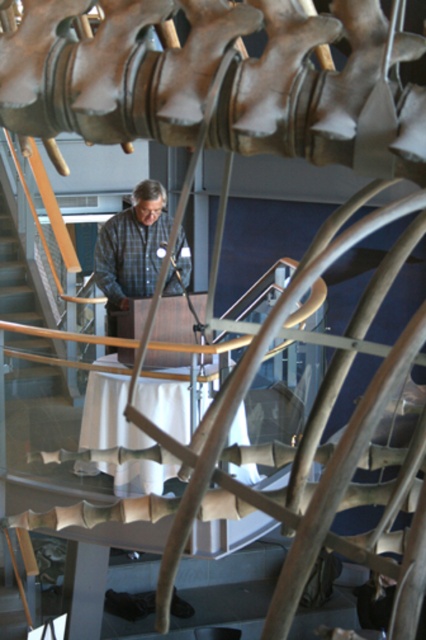
Can you confirm if plaid shirt at center is positioned to the left of wooden at left?

Incorrect, plaid shirt at center is not on the left side of wooden at left.

Does plaid shirt at center have a smaller size compared to wooden at left?

Correct, plaid shirt at center occupies less space than wooden at left.

Between point (167, 216) and point (31, 269), which one is positioned in front?

Positioned in front is point (167, 216).

Identify the location of plaid shirt at center. (132, 250).